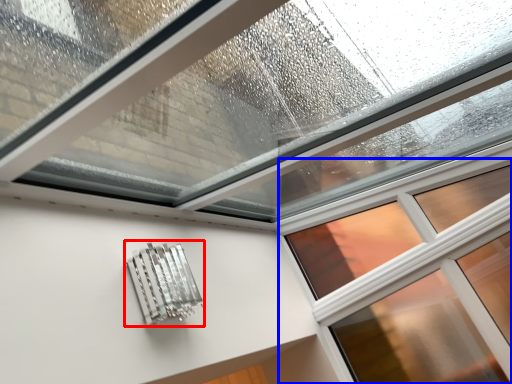
Question: Which point is further to the camera, metal (highlighted by a red box) or window (highlighted by a blue box)?

Choices:
 (A) metal
 (B) window

Answer: (B)